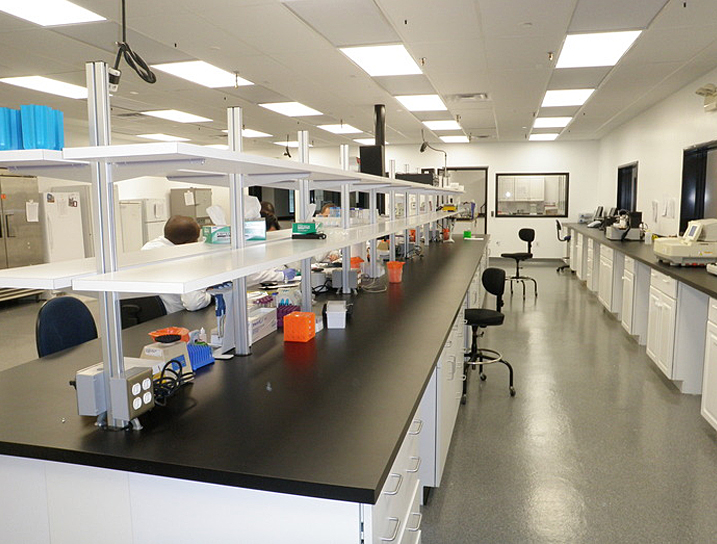
Where is `hanging electrical outlet`? This screenshot has width=717, height=544. hanging electrical outlet is located at coordinates (142, 69), (284, 149).